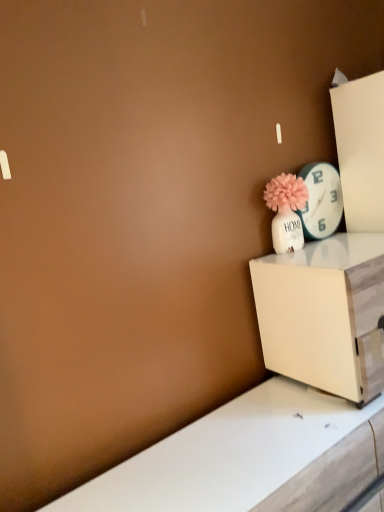
The width and height of the screenshot is (384, 512). In order to click on vacant area in front of matte white vase with pink flower at upper right in this screenshot , I will do `click(316, 259)`.